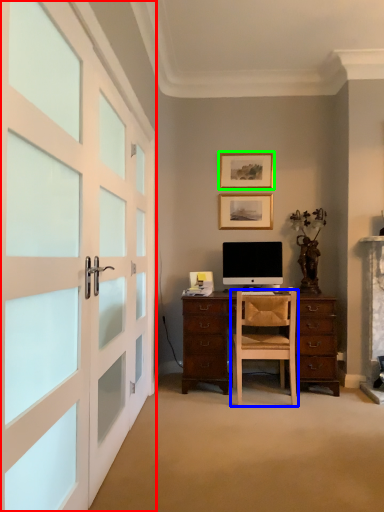
Question: Based on their relative distances, which object is nearer to garage door (highlighted by a red box)? Choose from chair (highlighted by a blue box) and picture frame (highlighted by a green box).

Choices:
 (A) chair
 (B) picture frame

Answer: (A)